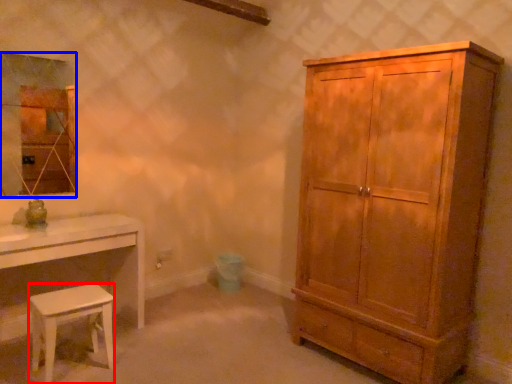
Question: Among these objects, which one is farthest to the camera, stool (highlighted by a red box) or mirror (highlighted by a blue box)?

Choices:
 (A) stool
 (B) mirror

Answer: (B)